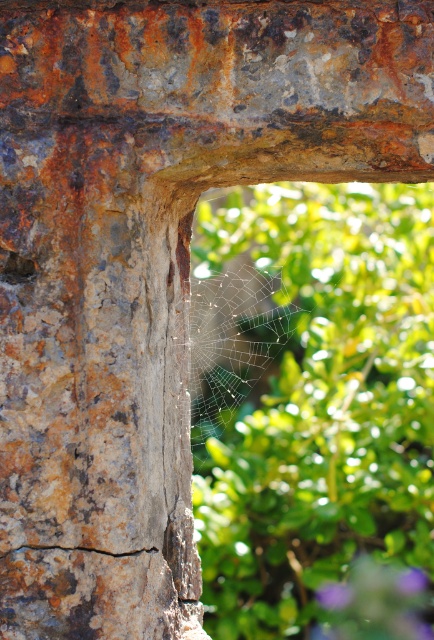
Which is more to the right, transparent silk spider web at center or purple matte flower at lower right?

Positioned to the right is purple matte flower at lower right.

Is transparent silk spider web at center above purple matte flower at lower right?

Indeed, transparent silk spider web at center is positioned over purple matte flower at lower right.

Image resolution: width=434 pixels, height=640 pixels. What do you see at coordinates (234, 340) in the screenshot?
I see `transparent silk spider web at center` at bounding box center [234, 340].

This screenshot has width=434, height=640. In order to click on transparent silk spider web at center in this screenshot , I will do `click(234, 340)`.

Can you confirm if transparent silk spider web at center is positioned to the left of rusty metal crack at lower left?

No, transparent silk spider web at center is not to the left of rusty metal crack at lower left.

Who is taller, transparent silk spider web at center or rusty metal crack at lower left?

Standing taller between the two is transparent silk spider web at center.

Does point (220, 269) lie behind point (3, 545)?

Yes.

Locate an element on the screen. transparent silk spider web at center is located at coordinates (234, 340).

Is transparent silk spider web at center to the left of rusty metal hole at left from the viewer's perspective?

Incorrect, transparent silk spider web at center is not on the left side of rusty metal hole at left.

From the picture: Can you confirm if transparent silk spider web at center is positioned above rusty metal hole at left?

No, transparent silk spider web at center is not above rusty metal hole at left.

Does point (249, 336) come closer to viewer compared to point (3, 280)?

No, it is not.

Image resolution: width=434 pixels, height=640 pixels. Identify the location of transparent silk spider web at center. (234, 340).